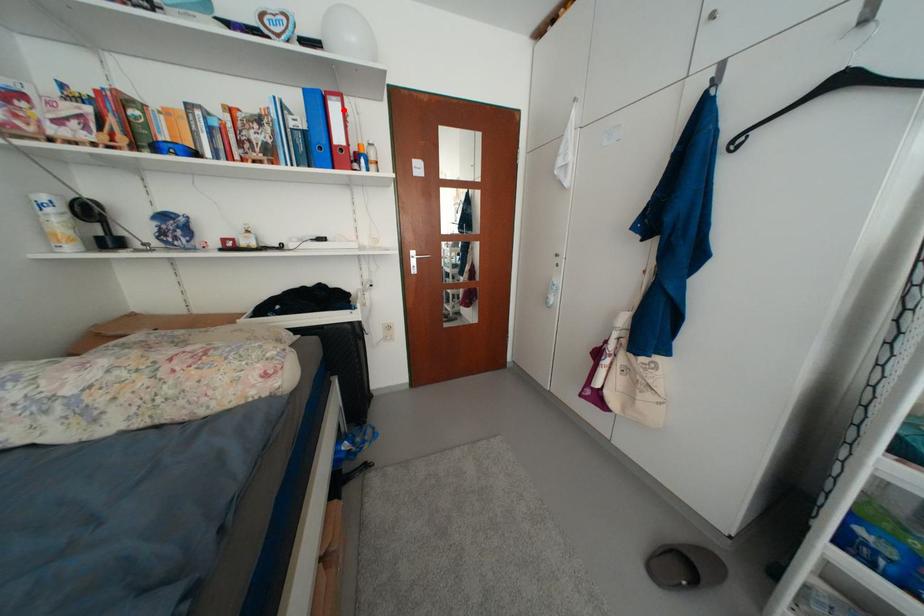
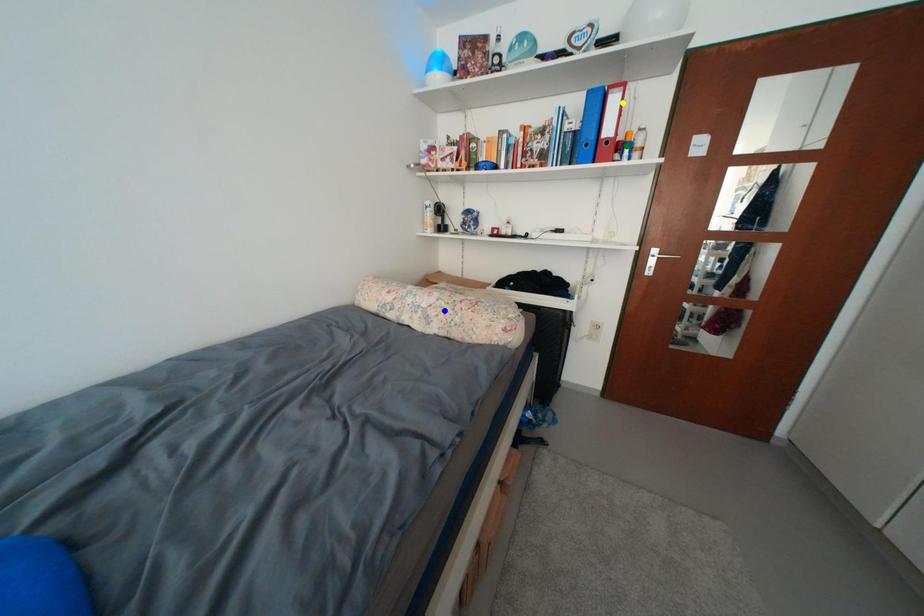
Question: I am providing you with two images of the same scene from different viewpoints. A red point is marked on the first image. You are given multiple points on the second image. Which spot in image 2 lines up with the point in image 1?

Choices:
 (A) blue point
 (B) green point
 (C) yellow point

Answer: (C)